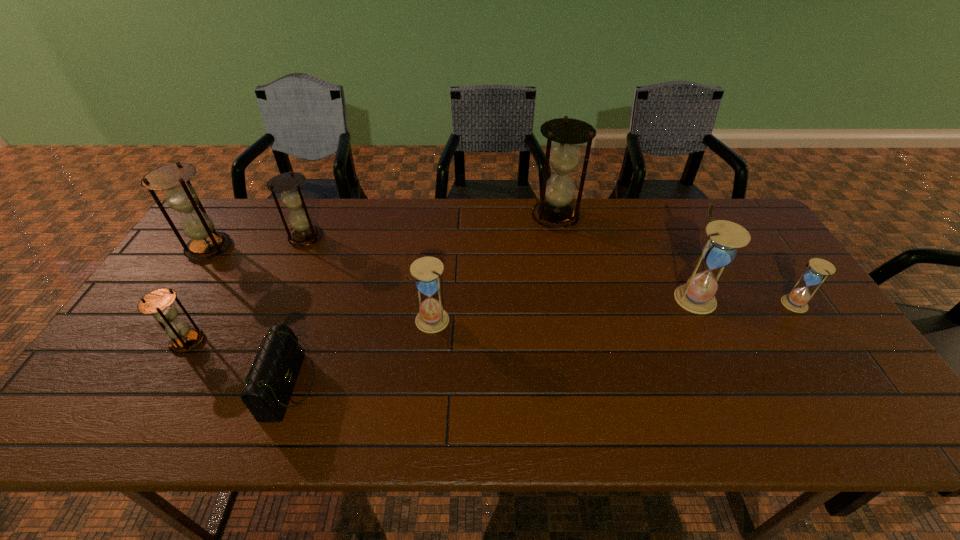
The height and width of the screenshot is (540, 960). What are the coordinates of `the smallest white hourglass` in the screenshot? It's located at pos(818,269).

This screenshot has height=540, width=960. I want to click on the smallest brown hourglass, so tap(159, 303).

This screenshot has width=960, height=540. Identify the location of clutch bag. (273, 374).

Image resolution: width=960 pixels, height=540 pixels. Find the location of `vacant area situated on the right of the tallest object`. vacant area situated on the right of the tallest object is located at coordinates (594, 217).

You are a GUI agent. You are given a task and a screenshot of the screen. Output one action in this format:
    pyautogui.click(x=<x>, y=<y>)
    Task: Click on the vacant space situated on the right of the third smallest brown hourglass
    The height and width of the screenshot is (540, 960).
    Given the screenshot: What is the action you would take?
    pyautogui.click(x=266, y=248)

Where is `vacant space located 0.190m on the front of the seventh object from left to right`? The width and height of the screenshot is (960, 540). vacant space located 0.190m on the front of the seventh object from left to right is located at coordinates (731, 375).

Identify the location of free region located on the left of the fifth hourglass from right to left. Image resolution: width=960 pixels, height=540 pixels. (235, 238).

The image size is (960, 540). I want to click on vacant space located 0.260m on the left of the fourth hourglass from right to left, so click(317, 321).

Image resolution: width=960 pixels, height=540 pixels. In order to click on vacant space located 0.260m on the front of the rightmost object in this screenshot , I will do `click(856, 400)`.

Where is `vacant space situated on the right of the nearest brown hourglass`? This screenshot has width=960, height=540. vacant space situated on the right of the nearest brown hourglass is located at coordinates (346, 342).